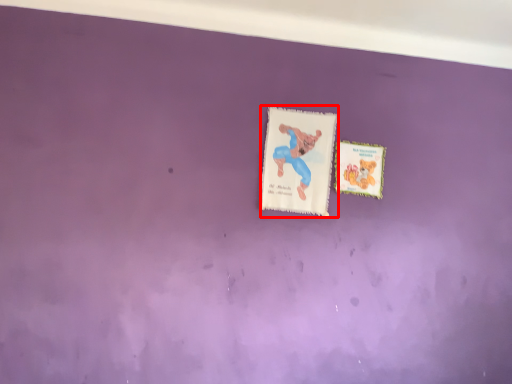
Question: In this image, where is postcard (annotated by the red box) located relative to postcard?

Choices:
 (A) right
 (B) left

Answer: (B)